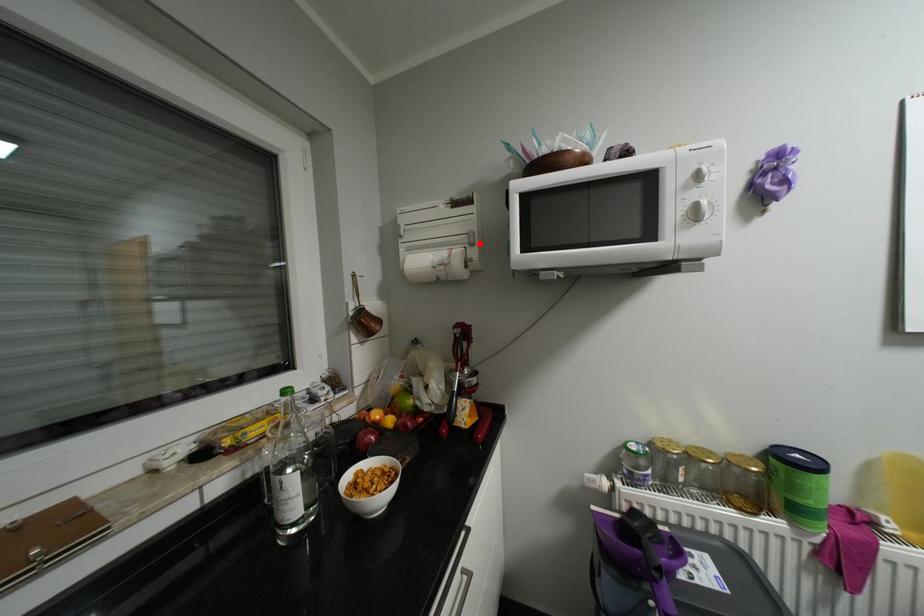
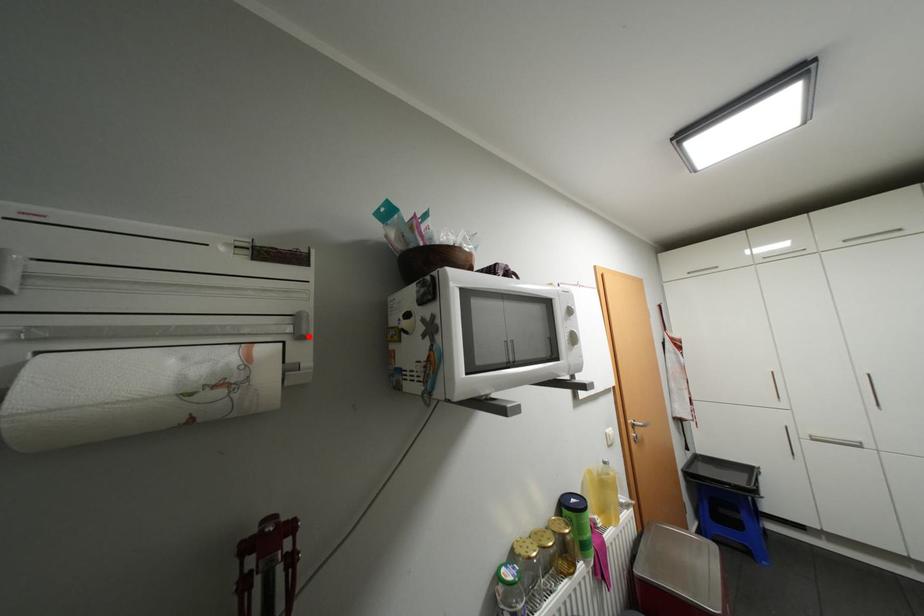
I am providing you with two images of the same scene from different viewpoints. A red point is marked on the first image and another point is marked on the second image. Is the red point in image1 aligned with the point shown in image2?

Yes